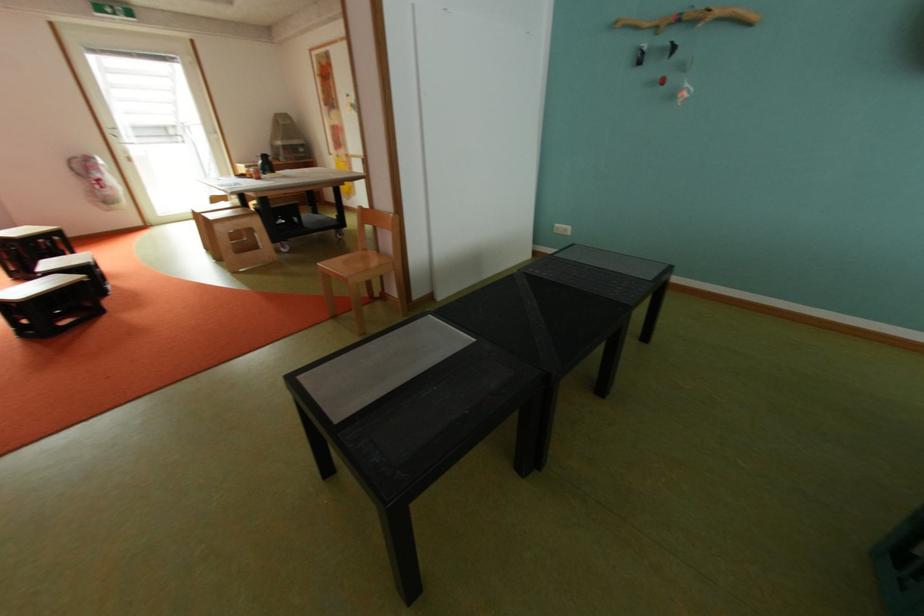
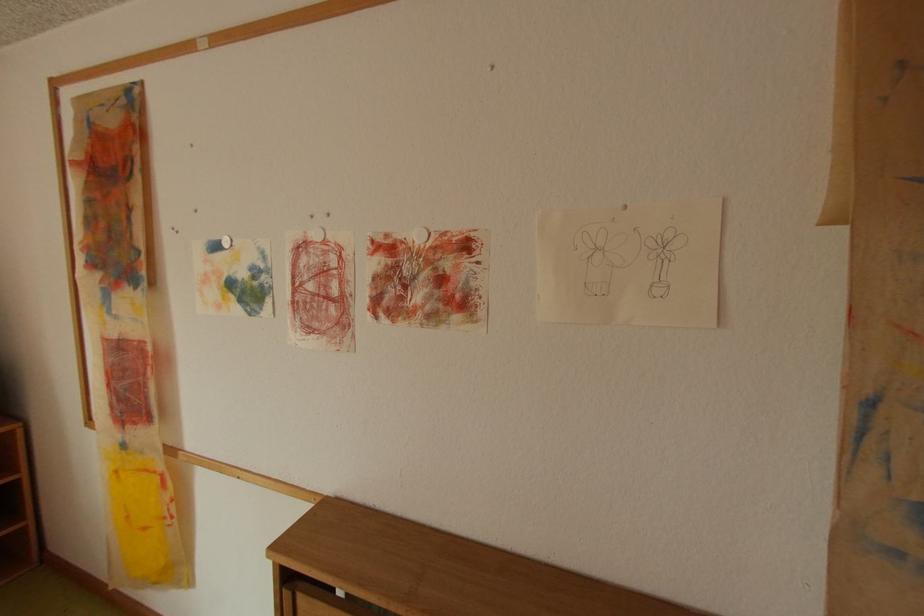
Where in the second image is the point corresponding to (x=357, y=95) from the first image?

(225, 246)